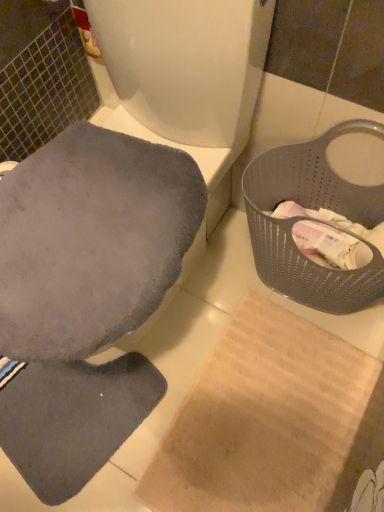
Describe the element at coordinates (315, 208) in the screenshot. I see `gray perforated basket at right` at that location.

Where is `gray perforated basket at right`? gray perforated basket at right is located at coordinates (315, 208).

Image resolution: width=384 pixels, height=512 pixels. Describe the element at coordinates (182, 73) in the screenshot. I see `gray soft fabric toilet seat at upper left` at that location.

Looking at this image, measure the distance between point (252,5) and camera.

The depth of point (252,5) is 24.53 inches.

Identify the location of gray soft fabric toilet seat at upper left. (182, 73).

The width and height of the screenshot is (384, 512). Identify the location of gray perforated basket at right. pos(315,208).

Considering the positions of objects gray soft fabric toilet seat at upper left and gray perforated basket at right in the image provided, who is more to the left, gray soft fabric toilet seat at upper left or gray perforated basket at right?

Positioned to the left is gray soft fabric toilet seat at upper left.

Which object is further away from the camera, gray soft fabric toilet seat at upper left or gray perforated basket at right?

gray perforated basket at right is more distant.

Which is closer to the camera, [132,48] or [277,184]?

Point [132,48] appears to be closer to the viewer than point [277,184].

From the image's perspective, who appears lower, gray soft fabric toilet seat at upper left or gray perforated basket at right?

gray perforated basket at right, from the image's perspective.

From a real-world perspective, is gray soft fabric toilet seat at upper left located higher than gray perforated basket at right?

Yes.

Which object is thinner, gray soft fabric toilet seat at upper left or gray perforated basket at right?

gray perforated basket at right.

Between gray soft fabric toilet seat at upper left and gray perforated basket at right, which one has less height?

Standing shorter between the two is gray perforated basket at right.

Looking at this image, looking at the image, does gray soft fabric toilet seat at upper left seem bigger or smaller compared to gray perforated basket at right?

Considering their sizes, gray soft fabric toilet seat at upper left takes up more space than gray perforated basket at right.

Choose the correct answer: Is gray soft fabric toilet seat at upper left inside gray perforated basket at right or outside it?

gray soft fabric toilet seat at upper left cannot be found inside gray perforated basket at right.

Is gray soft fabric toilet seat at upper left far from gray perforated basket at right?

gray soft fabric toilet seat at upper left is near gray perforated basket at right, not far away.

Is gray soft fabric toilet seat at upper left oriented away from gray perforated basket at right?

No, gray soft fabric toilet seat at upper left is not facing away from gray perforated basket at right.

From the picture: Can you tell me how much gray soft fabric toilet seat at upper left and gray perforated basket at right differ in facing direction?

They differ by 2.2 degrees in their facing directions.

Find the location of a particular element. The height and width of the screenshot is (512, 384). toilet that is in front of the gray perforated basket at right is located at coordinates (182, 73).

Is gray perforated basket at right to the left of gray soft fabric toilet seat at upper left from the viewer's perspective?

No, gray perforated basket at right is not to the left of gray soft fabric toilet seat at upper left.

Is gray perforated basket at right further to camera compared to gray soft fabric toilet seat at upper left?

Yes, it is behind gray soft fabric toilet seat at upper left.

Is point (254, 223) closer to viewer compared to point (96, 77)?

Yes, point (254, 223) is in front of point (96, 77).

From the image's perspective, is gray perforated basket at right located above or below gray soft fabric toilet seat at upper left?

gray perforated basket at right is situated lower than gray soft fabric toilet seat at upper left in the image.

From a real-world perspective, is gray perforated basket at right positioned above or below gray soft fabric toilet seat at upper left?

Clearly, from a real-world perspective, gray perforated basket at right is below gray soft fabric toilet seat at upper left.

Can you confirm if gray perforated basket at right is thinner than gray soft fabric toilet seat at upper left?

Yes.

Between gray perforated basket at right and gray soft fabric toilet seat at upper left, which one has more height?

Standing taller between the two is gray soft fabric toilet seat at upper left.

Based on the photo, does gray perforated basket at right have a smaller size compared to gray soft fabric toilet seat at upper left?

Yes.

Can we say gray perforated basket at right lies outside gray soft fabric toilet seat at upper left?

gray perforated basket at right lies outside gray soft fabric toilet seat at upper left's area.

Consider the image. Can you see gray perforated basket at right touching gray soft fabric toilet seat at upper left?

No, gray perforated basket at right is not in contact with gray soft fabric toilet seat at upper left.

Is gray perforated basket at right positioned with its back to gray soft fabric toilet seat at upper left?

No, gray perforated basket at right is not facing the opposite direction of gray soft fabric toilet seat at upper left.

How many degrees apart are the facing directions of gray perforated basket at right and gray soft fabric toilet seat at upper left?

2.2 degrees.

Measure the distance from gray perforated basket at right to gray soft fabric toilet seat at upper left.

They are 10.40 inches apart.

Find the location of a particular element. toilet lying in front of the gray perforated basket at right is located at coordinates (182, 73).

Locate an element on the screen. basket container below the gray soft fabric toilet seat at upper left (from a real-world perspective) is located at coordinates (315, 208).

Image resolution: width=384 pixels, height=512 pixels. I want to click on toilet located in front of the gray perforated basket at right, so click(182, 73).